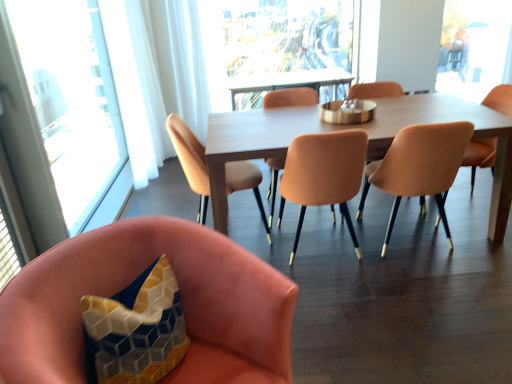
Find the location of a particular element. The image size is (512, 384). free space that is in between matte orange chair at center, which is counted as the fifth chair, starting from the left, and matte orange chair at center, which appears as the third chair when viewed from the right is located at coordinates (362, 242).